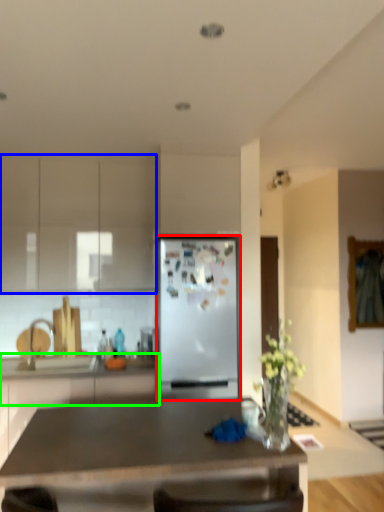
Question: Which is farther away from refrigerator (highlighted by a red box)? cabinetry (highlighted by a blue box) or counter top (highlighted by a green box)?

Choices:
 (A) cabinetry
 (B) counter top

Answer: (A)